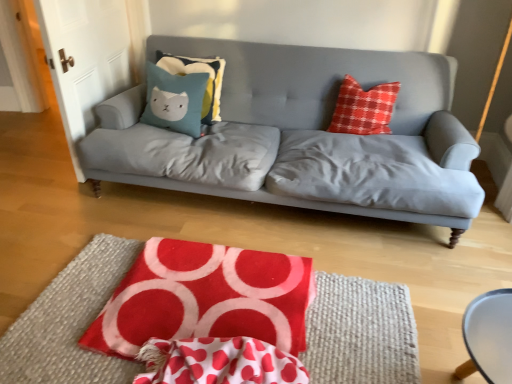
This screenshot has height=384, width=512. In order to click on vacant space that's between red polka dot fabric at center and red velvety quilt at lower center in this screenshot , I will do `click(127, 369)`.